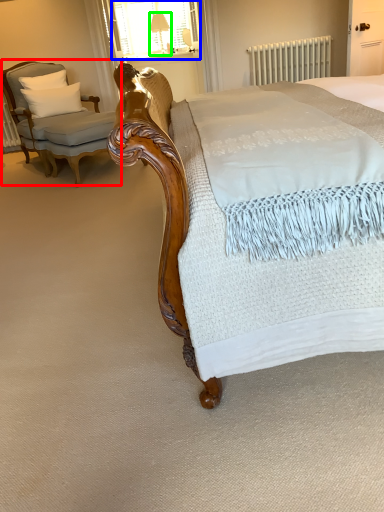
Question: Estimate the real-world distances between objects in this image. Which object is farther from chair (highlighted by a red box), window screen (highlighted by a blue box) or table lamp (highlighted by a green box)?

Choices:
 (A) window screen
 (B) table lamp

Answer: (B)